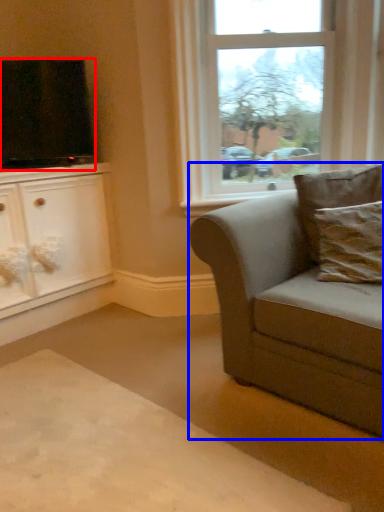
Question: Which object appears farthest to the camera in this image, television (highlighted by a red box) or studio couch (highlighted by a blue box)?

Choices:
 (A) television
 (B) studio couch

Answer: (A)